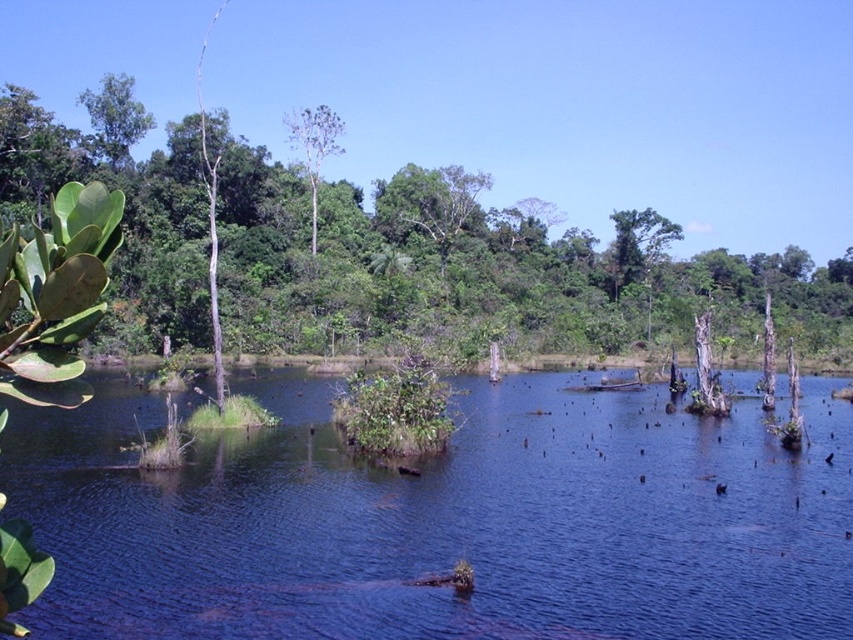
You are a bird seeking shelter in the wetland. Which tree would provide more coverage, the green leafy tree at left or the green leafy tree at center?

The green leafy tree at left has a larger size compared to the green leafy tree at center, so it would provide more coverage for the bird seeking shelter.

You are a bird flying over the wetland and want to land on a tree. Which tree would you reach first if you fly straight towards the scene? The green leafy tree at left or the green leafy tree at center?

The green leafy tree at left is in front of the green leafy tree at center, so you would reach the green leafy tree at left first.